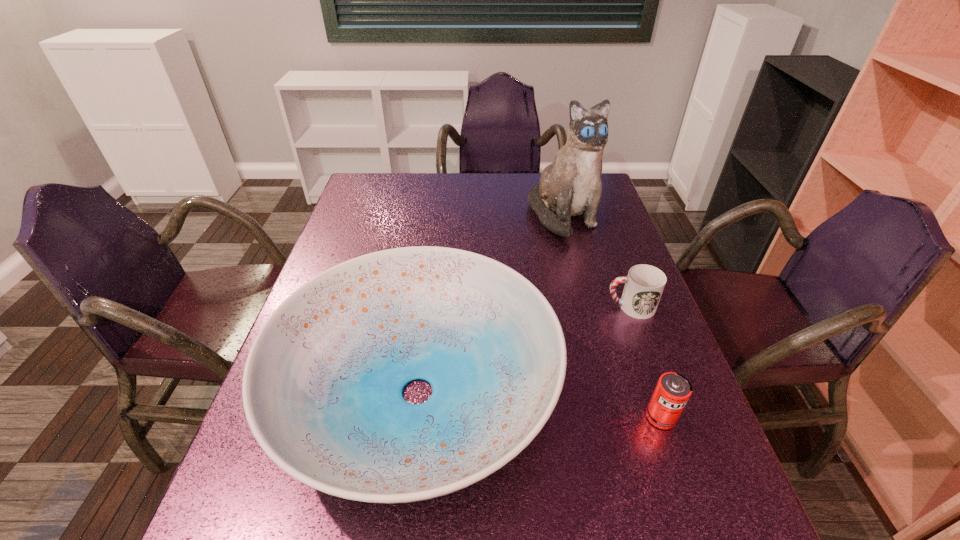
The height and width of the screenshot is (540, 960). I want to click on the farthest object, so click(x=570, y=186).

Where is `the tallest object`? the tallest object is located at coordinates (570, 186).

Identify the location of can. The image size is (960, 540). (672, 392).

Find the location of a particular element. cup is located at coordinates (644, 285).

The width and height of the screenshot is (960, 540). What are the coordinates of `blank area located at the face of the farthest object` in the screenshot? It's located at (581, 286).

Identify the location of vacant space located on the front of the can. Image resolution: width=960 pixels, height=540 pixels. (676, 461).

Identify the location of free spot located 0.230m on the handle side of the cup. Image resolution: width=960 pixels, height=540 pixels. 514,307.

The width and height of the screenshot is (960, 540). Identify the location of free space located on the handle side of the cup. (529, 307).

Image resolution: width=960 pixels, height=540 pixels. I want to click on vacant space located 0.150m on the handle side of the cup, so click(545, 307).

The width and height of the screenshot is (960, 540). Find the location of `object located at the far edge`. object located at the far edge is located at coordinates (570, 186).